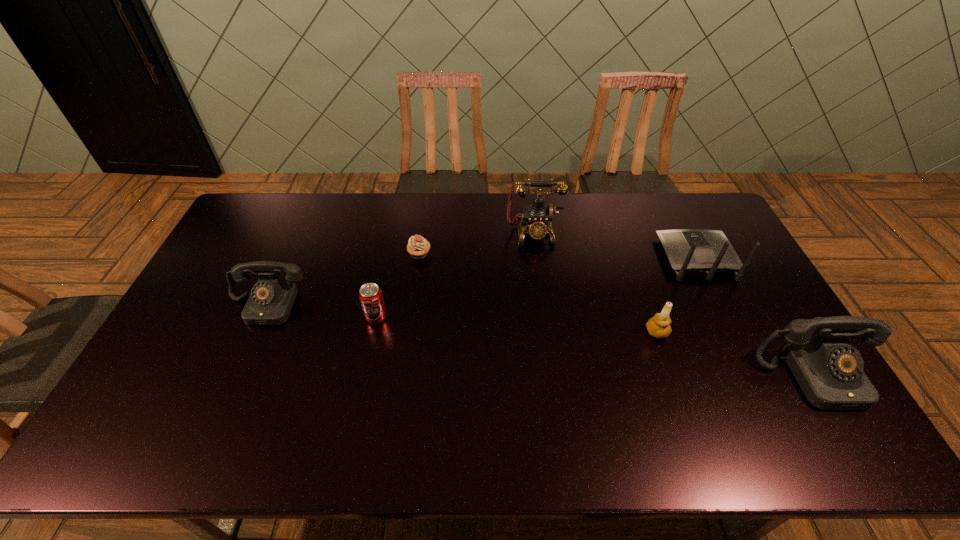
Where is `candle_holder`? The width and height of the screenshot is (960, 540). candle_holder is located at coordinates (659, 326).

Find the location of a particular element. The width and height of the screenshot is (960, 540). free space located on the dial of the second nearest telephone is located at coordinates point(228,394).

Where is `vacant space located 0.310m on the left of the sixth object from right to left`? The width and height of the screenshot is (960, 540). vacant space located 0.310m on the left of the sixth object from right to left is located at coordinates (261, 317).

At what (x,y) coordinates should I click in order to perform the action: click on vacant space located on the front-facing side of the router. Please return your answer as a coordinate pair (x, y). This screenshot has height=540, width=960. Looking at the image, I should click on (680, 224).

Where is `free spot located on the front-facing side of the router`? free spot located on the front-facing side of the router is located at coordinates (670, 204).

In order to click on vacant area located on the front-facing side of the router in this screenshot , I will do `click(675, 214)`.

I want to click on vacant area located on the right of the cupcake, so click(x=519, y=254).

The height and width of the screenshot is (540, 960). In order to click on vacant point located on the front of the farthest telephone, featuring the rotary dial in this screenshot , I will do `click(540, 280)`.

The width and height of the screenshot is (960, 540). In order to click on free space located on the back of the candle_holder in this screenshot , I will do `click(632, 259)`.

Identify the location of object positioned at the far edge. (538, 217).